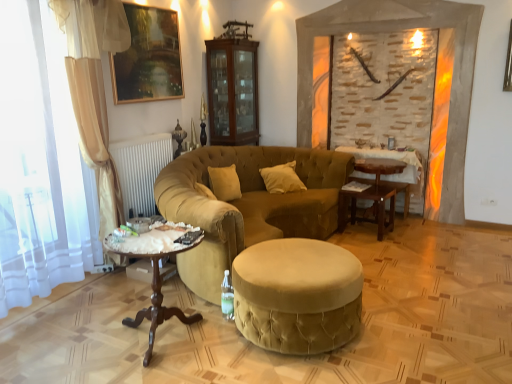
What are the coordinates of `free location to the left of wooden polished table at lower left` in the screenshot? It's located at (79, 336).